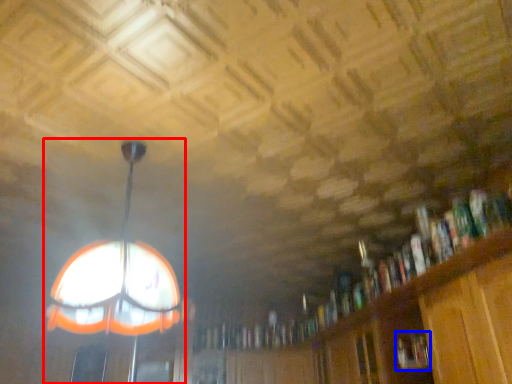
Question: Which of the following is the farthest to the observer, lamp (highlighted by a red box) or book (highlighted by a blue box)?

Choices:
 (A) lamp
 (B) book

Answer: (B)